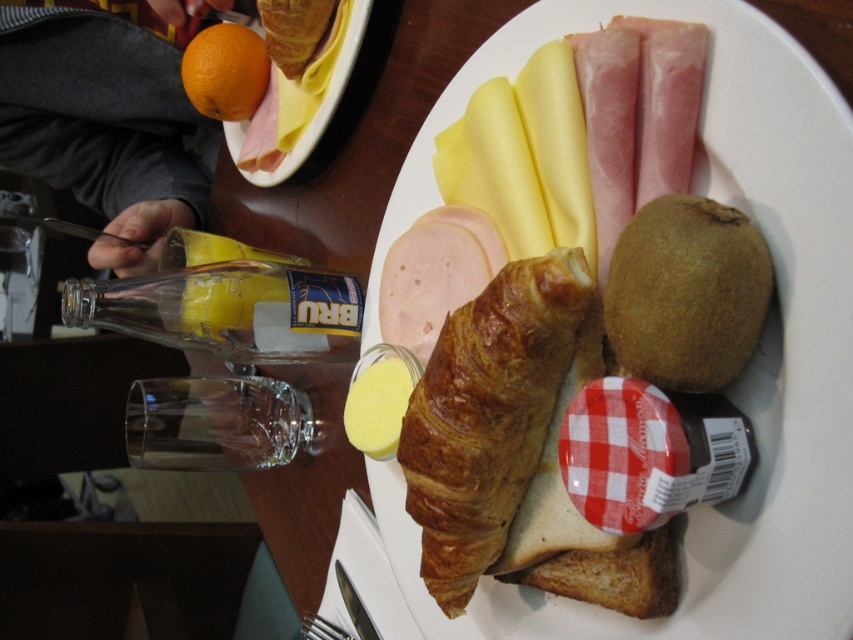
Can you confirm if golden brown flaky croissant at center is thinner than toasted white bread at lower center?

In fact, golden brown flaky croissant at center might be wider than toasted white bread at lower center.

Who is positioned more to the right, golden brown flaky croissant at center or toasted white bread at lower center?

toasted white bread at lower center is more to the right.

Measure the distance between golden brown flaky croissant at center and camera.

golden brown flaky croissant at center and camera are 14.50 inches apart.

Identify the location of golden brown flaky croissant at center. (486, 416).

How far apart are brown fuzzy kiwi at right and toasted white bread at lower center?

brown fuzzy kiwi at right is 4.58 inches from toasted white bread at lower center.

Can you confirm if brown fuzzy kiwi at right is positioned to the left of toasted white bread at lower center?

No, brown fuzzy kiwi at right is not to the left of toasted white bread at lower center.

In order to click on brown fuzzy kiwi at right in this screenshot , I will do `click(686, 292)`.

Does golden brown croissant at center have a greater height compared to orange matte fruit at upper left?

Correct, golden brown croissant at center is much taller as orange matte fruit at upper left.

Based on the photo, does golden brown croissant at center appear under orange matte fruit at upper left?

Correct, golden brown croissant at center is located below orange matte fruit at upper left.

Who is more forward, (674, 621) or (351, 22)?

Point (674, 621) is more forward.

This screenshot has height=640, width=853. I want to click on golden brown croissant at center, so click(x=738, y=380).